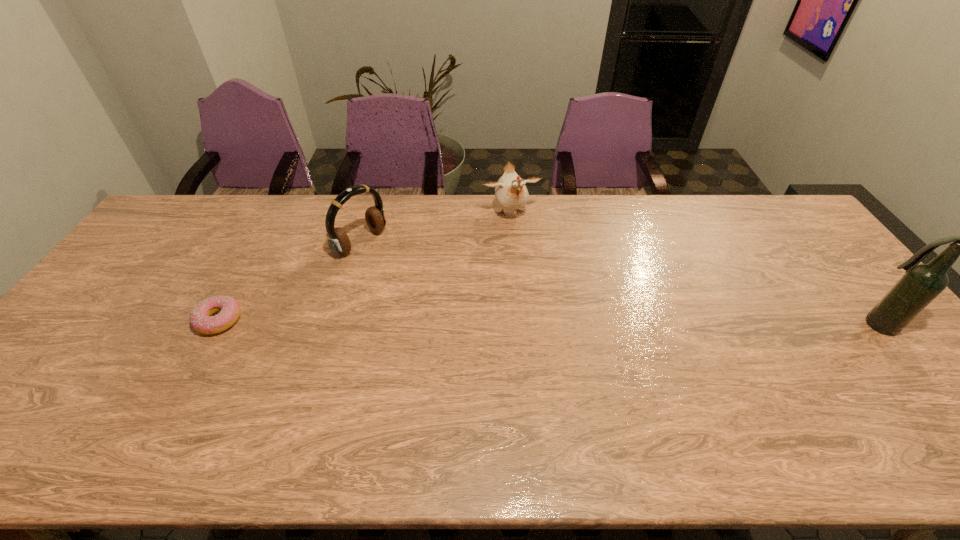
I want to click on vacant area at the right edge of the desktop, so point(782,245).

At what (x,y) coordinates should I click in order to perform the action: click on free space at the far left corner of the desktop. Please return your answer as a coordinate pair (x, y). The image size is (960, 540). Looking at the image, I should click on (220, 197).

This screenshot has height=540, width=960. In order to click on free spot at the far right corner of the desktop in this screenshot , I will do `click(753, 210)`.

In order to click on free space between the leftmost object and the tallest object in this screenshot , I will do `click(548, 323)`.

Where is `free space between the headset and the rightmost object`? The width and height of the screenshot is (960, 540). free space between the headset and the rightmost object is located at coordinates (619, 284).

Where is `empty location between the bird and the beer bottle`? empty location between the bird and the beer bottle is located at coordinates (693, 269).

Where is `free space between the beer bottle and the doughnut`? free space between the beer bottle and the doughnut is located at coordinates (548, 323).

Locate an element on the screen. This screenshot has height=540, width=960. free space between the third object from right to left and the rightmost object is located at coordinates (619, 284).

Where is `empty space that is in between the second object from right to left and the headset`? empty space that is in between the second object from right to left and the headset is located at coordinates [x=436, y=228].

Where is `vacant space in between the headset and the leftmost object`? This screenshot has height=540, width=960. vacant space in between the headset and the leftmost object is located at coordinates (290, 281).